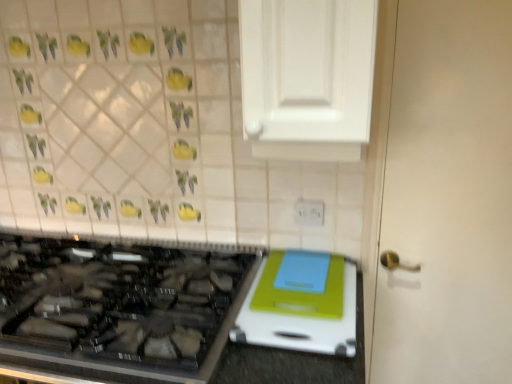
At what (x,y) coordinates should I click in order to perform the action: click on free location above white plastic cutting board at lower right (from a real-world perspective). Please return your answer as a coordinate pair (x, y). The height and width of the screenshot is (384, 512). Looking at the image, I should click on (296, 289).